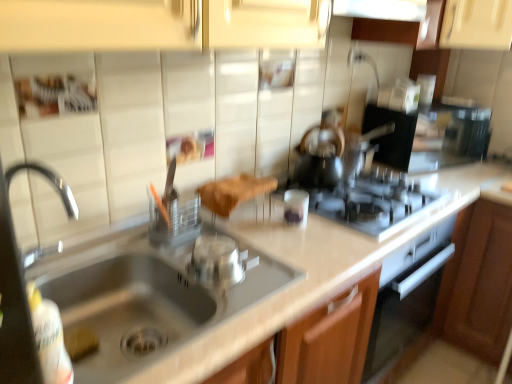
You are a GUI agent. You are given a task and a screenshot of the screen. Output one action in this format:
    pyautogui.click(x=<x>, y=<y>)
    Task: Click on the free point below translucent glass tea pot at center (from a real-world perspective)
    The image size is (512, 384).
    Given the screenshot: What is the action you would take?
    pyautogui.click(x=317, y=185)